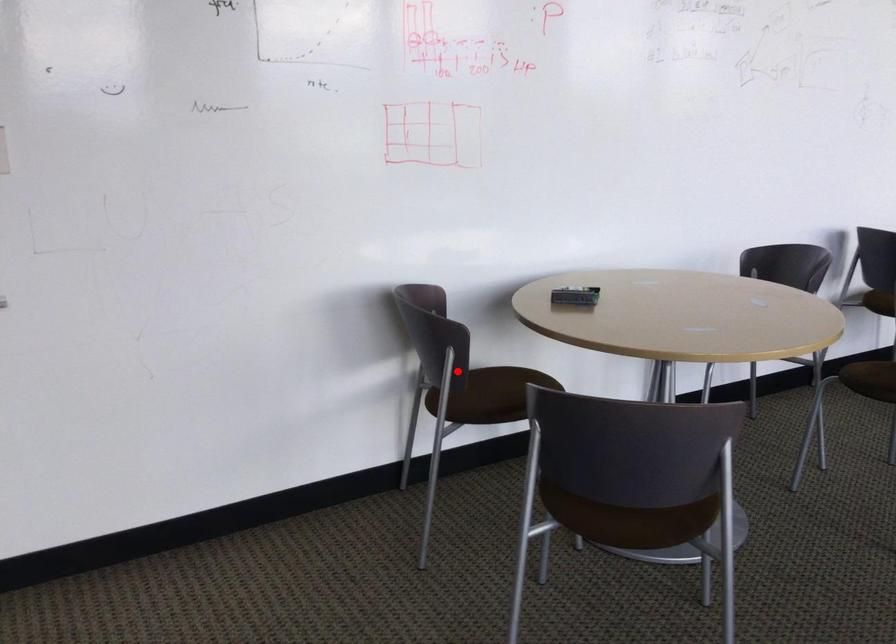
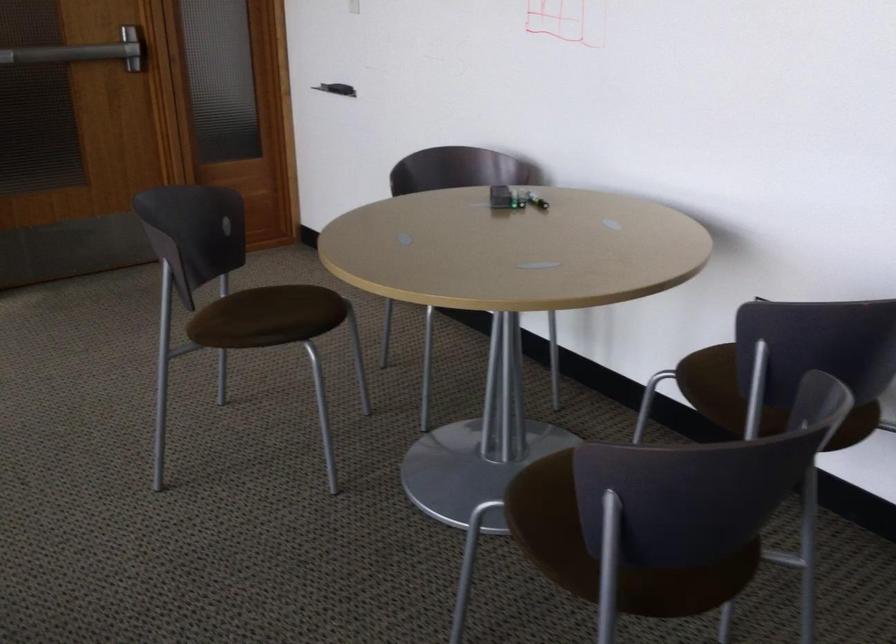
Question: I am providing you with two images of the same scene from different viewpoints. A red point is marked on the first image. Is the red point's position out of view in image 2?

Choices:
 (A) Yes
 (B) No

Answer: (A)